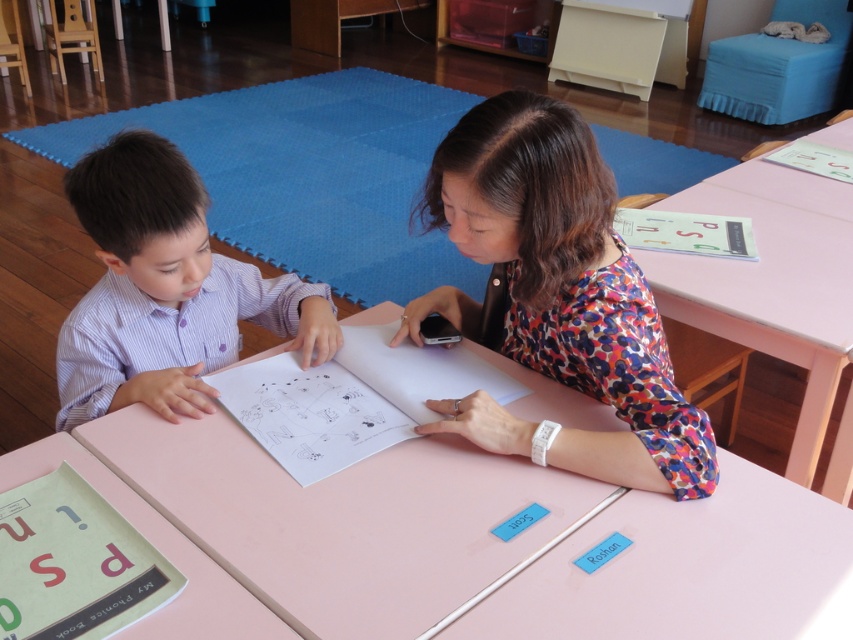
How distant is purple striped shirt at left from pink wood table at upper right?

purple striped shirt at left is 1.04 meters away from pink wood table at upper right.

What do you see at coordinates (165, 291) in the screenshot? The image size is (853, 640). I see `purple striped shirt at left` at bounding box center [165, 291].

Locate an element on the screen. This screenshot has width=853, height=640. purple striped shirt at left is located at coordinates (165, 291).

Between floral fabric blouse at center and purple striped shirt at left, which one has less height?

purple striped shirt at left is shorter.

Does point (614, 273) come farther from viewer compared to point (103, 195)?

That is True.

What do you see at coordinates (563, 296) in the screenshot? I see `floral fabric blouse at center` at bounding box center [563, 296].

Locate an element on the screen. The width and height of the screenshot is (853, 640). floral fabric blouse at center is located at coordinates (563, 296).

Is floral fabric blouse at center positioned before pink wood table at upper right?

Yes, floral fabric blouse at center is closer to the viewer.

Between floral fabric blouse at center and pink wood table at upper right, which one appears on the right side from the viewer's perspective?

pink wood table at upper right is more to the right.

Is point (651, 416) behind point (804, 401)?

That is False.

This screenshot has width=853, height=640. Find the location of `floral fabric blouse at center`. floral fabric blouse at center is located at coordinates (563, 296).